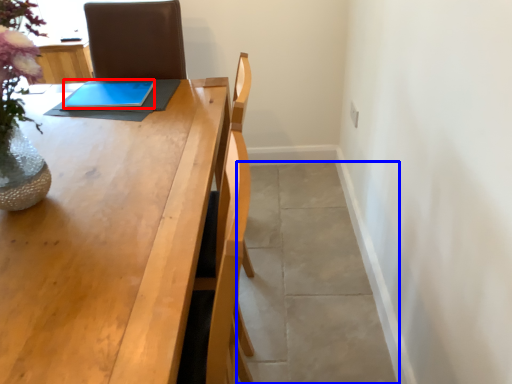
Question: Which of the following is the closest to the observer, tablet computer (highlighted by a red box) or concrete (highlighted by a blue box)?

Choices:
 (A) tablet computer
 (B) concrete

Answer: (B)